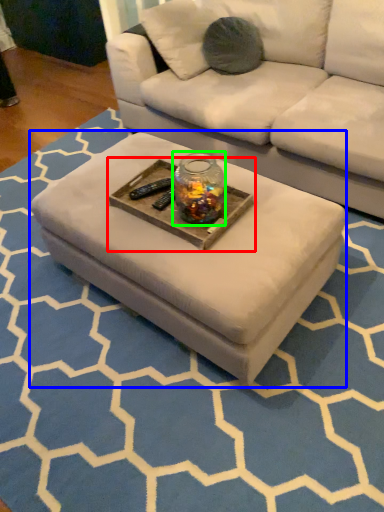
Question: Which object is the farthest from round table (highlighted by a red box)? Choose among these: coffee table (highlighted by a blue box) or glass jar (highlighted by a green box).

Choices:
 (A) coffee table
 (B) glass jar

Answer: (A)